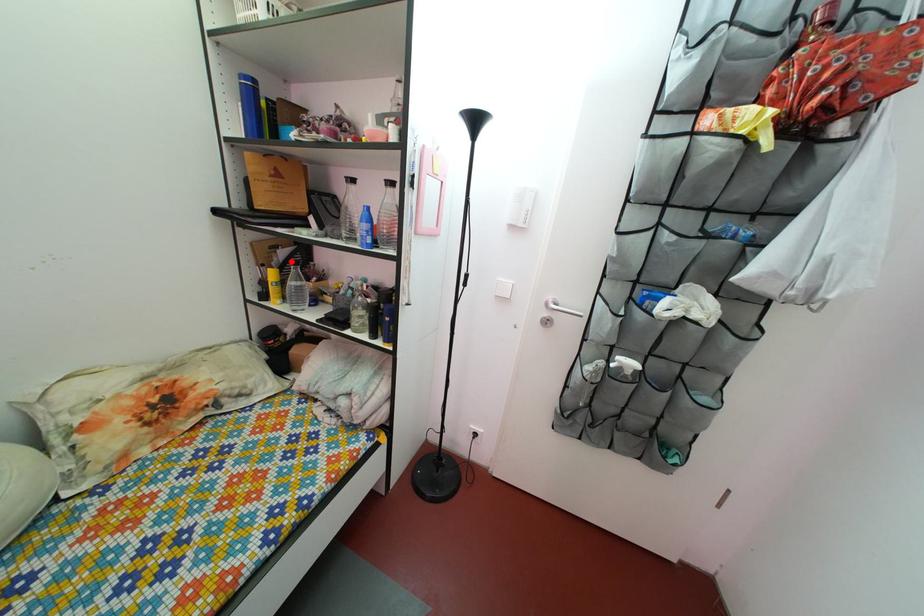
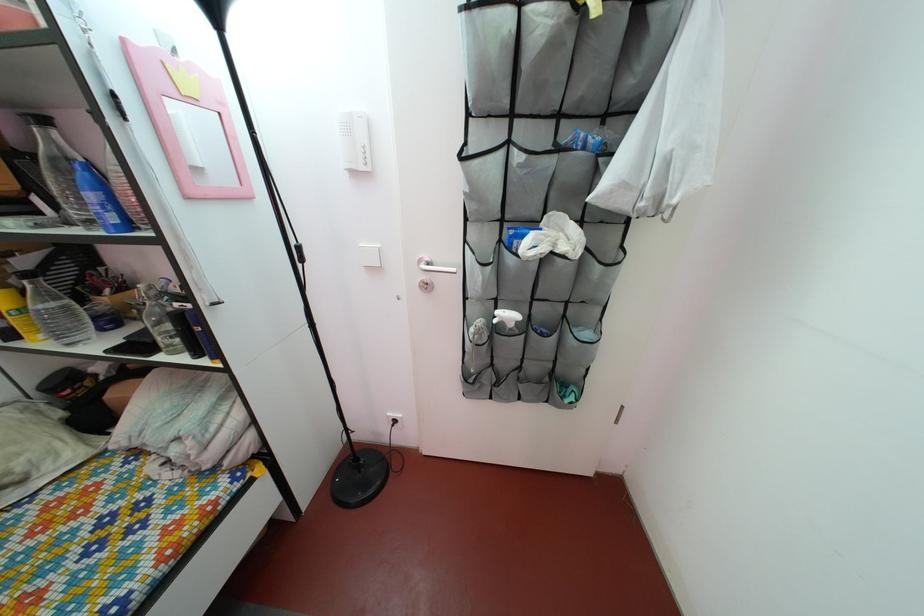
Question: I am providing you with two images of the same scene from different viewpoints. A red point is shown in image1. For the corresponding object point in image2, is it positioned nearer or farther from the camera?

Choices:
 (A) Nearer
 (B) Farther

Answer: (B)